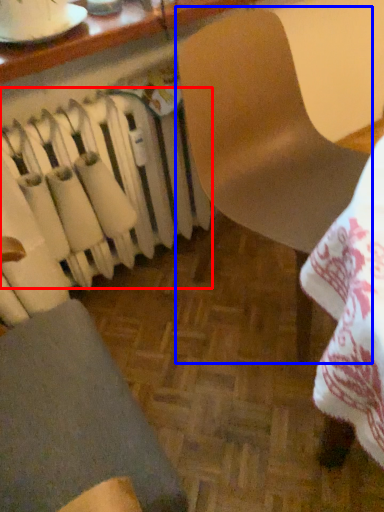
Question: Which of the following is the farthest to the observer, radiator (highlighted by a red box) or chair (highlighted by a blue box)?

Choices:
 (A) radiator
 (B) chair

Answer: (A)